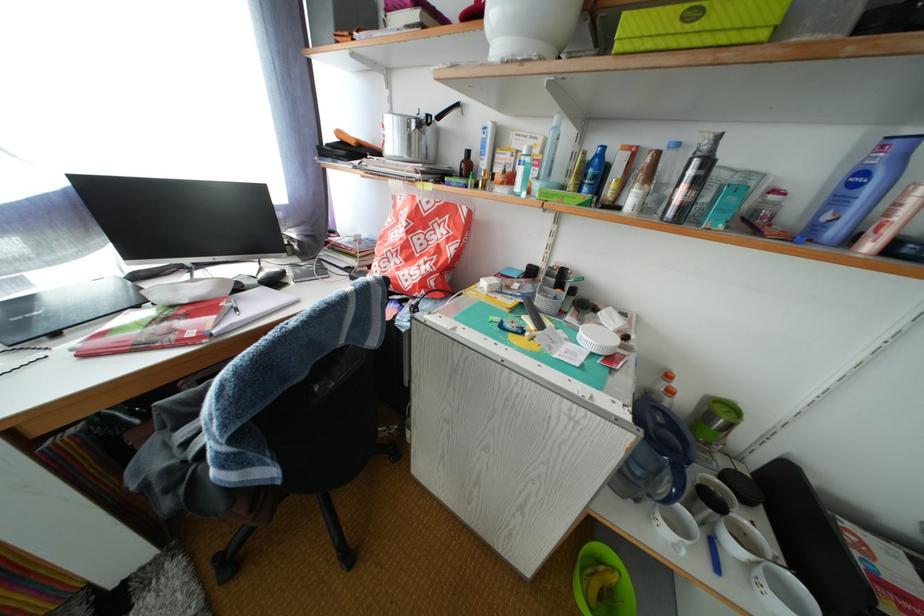
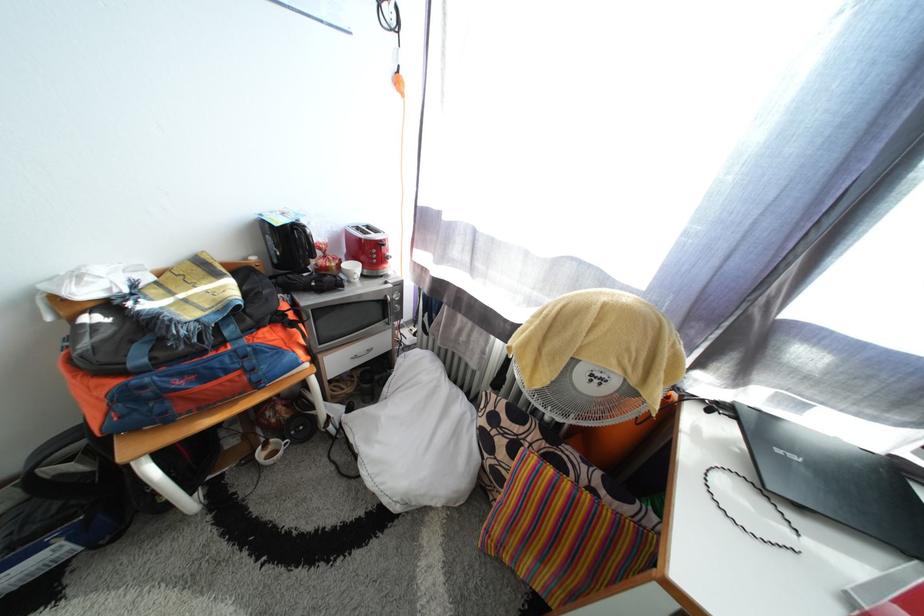
Find the pixel in the second image that matches [41,306] in the first image.

(785, 424)